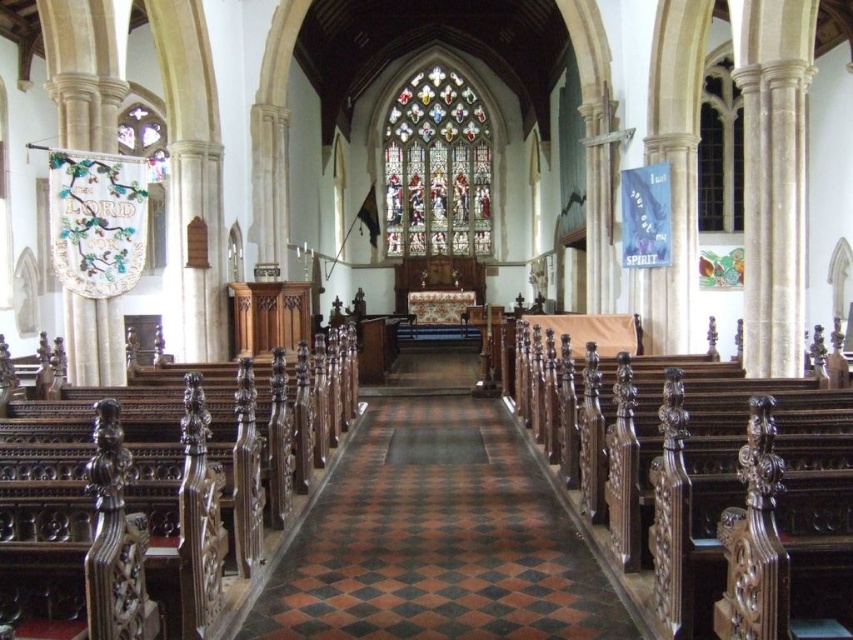
Is brown polished wood aisle at center taller than stained glass window at center?

Incorrect, brown polished wood aisle at center's height is not larger of stained glass window at center's.

Which is more to the left, brown polished wood aisle at center or stained glass window at center?

Positioned to the left is brown polished wood aisle at center.

Does point (527, 547) come behind point (396, 147)?

No, (527, 547) is in front of (396, 147).

At what (x,y) coordinates should I click in order to perform the action: click on brown polished wood aisle at center. Please return your answer as a coordinate pair (x, y). Looking at the image, I should click on 437,540.